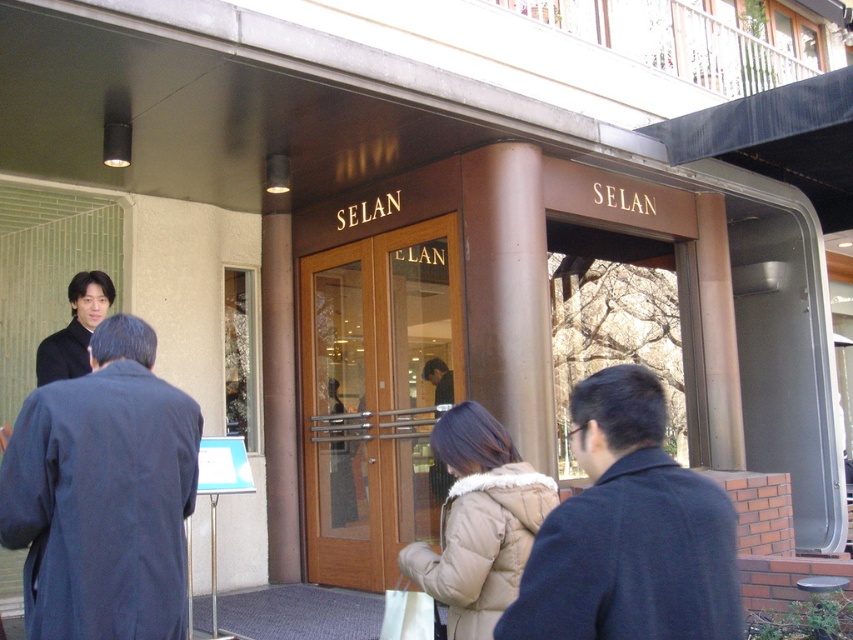
Question: Which of the following is the farthest from the observer?

Choices:
 (A) beige puffy coat at center
 (B) dark blue coat at center
 (C) dark blue coat at left
 (D) matte black coat at center

Answer: (D)

Question: Estimate the real-world distances between objects in this image. Which object is closer to the dark blue coat at left?

Choices:
 (A) beige puffy coat at center
 (B) dark blue coat at center
 (C) transparent wooden door at center

Answer: (A)

Question: Which object is the farthest from the transparent wooden door at center?

Choices:
 (A) dark blue coat at center
 (B) matte black coat at center

Answer: (A)

Question: Can you confirm if beige puffy coat at center is bigger than matte black coat at center?

Choices:
 (A) yes
 (B) no

Answer: (A)

Question: Can you confirm if dark blue coat at left is positioned to the left of dark blue coat at center?

Choices:
 (A) yes
 (B) no

Answer: (A)

Question: Does dark blue coat at left appear on the left side of matte black coat at center?

Choices:
 (A) yes
 (B) no

Answer: (B)